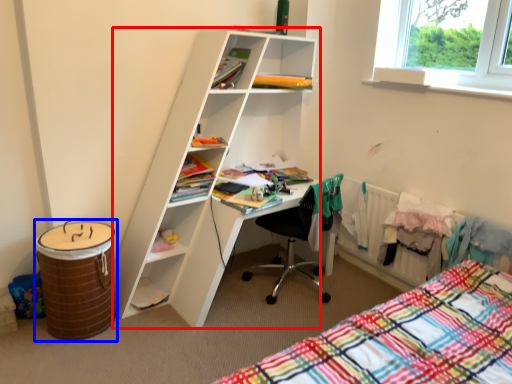
Question: Which object is further to the camera taking this photo, shelf (highlighted by a red box) or barrel (highlighted by a blue box)?

Choices:
 (A) shelf
 (B) barrel

Answer: (B)